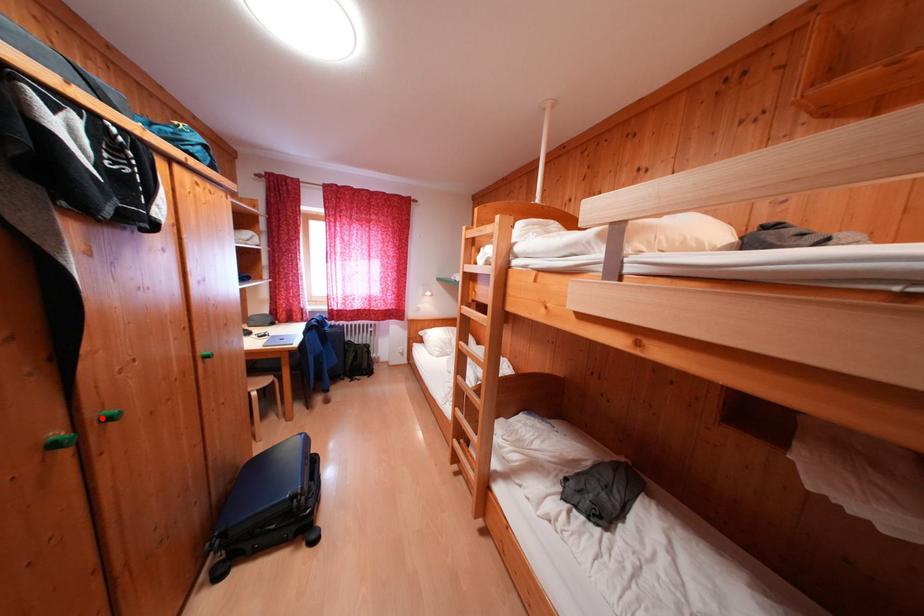
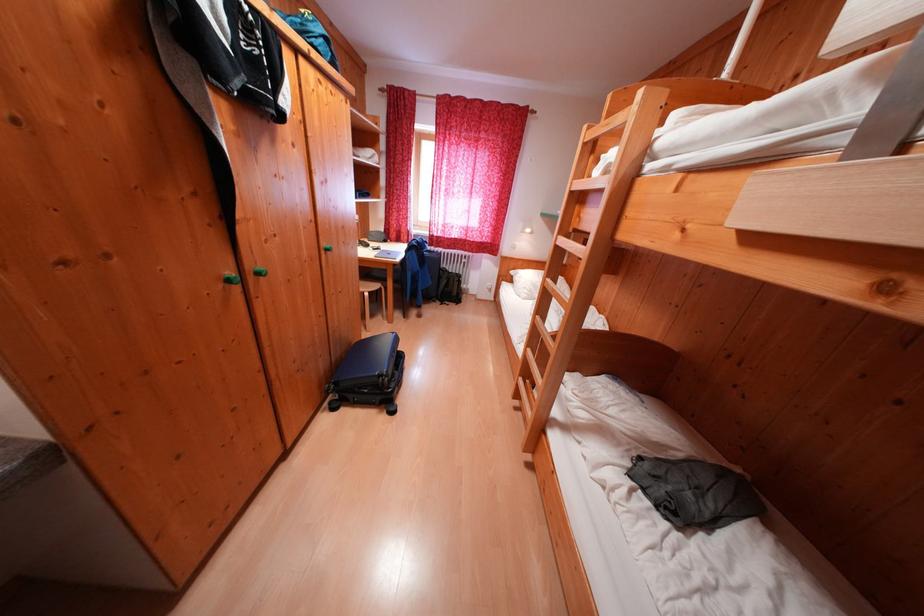
Question: I am providing you with two images of the same scene from different viewpoints. A red point is shown in image1. For the corresponding object point in image2, is it positioned nearer or farther from the camera?

Choices:
 (A) Nearer
 (B) Farther

Answer: (A)